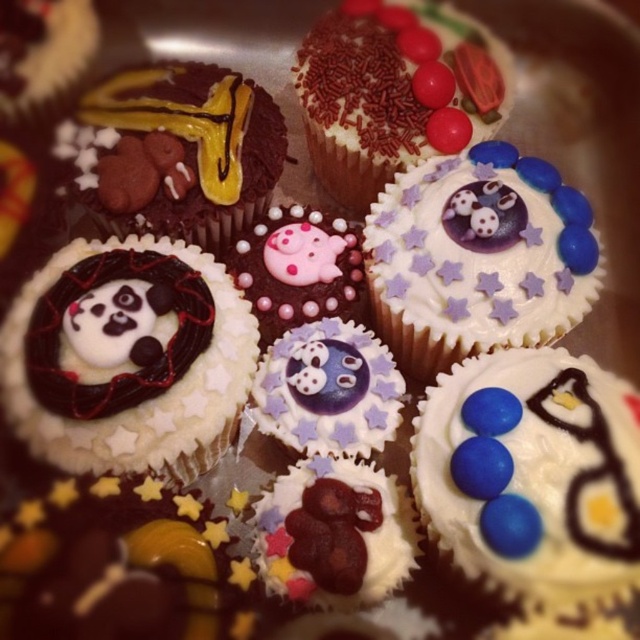
Does chocolate glossy cherries at center have a smaller size compared to chocolate matte pig at center?

Correct, chocolate glossy cherries at center occupies less space than chocolate matte pig at center.

What do you see at coordinates (333, 532) in the screenshot?
I see `chocolate glossy cherries at center` at bounding box center [333, 532].

Which is in front, point (284, 499) or point (278, 301)?

Point (284, 499) is in front.

The height and width of the screenshot is (640, 640). In order to click on chocolate glossy cherries at center in this screenshot , I will do (x=333, y=532).

Does point (68, 416) come closer to viewer compared to point (262, 381)?

Yes, point (68, 416) is in front of point (262, 381).

Is white fondant cupcake with panda decoration at center positioned at the back of purple glossy cupcake at center?

That is False.

Between point (56, 344) and point (282, 349), which one is positioned behind?

The point (282, 349) is behind.

Locate an element on the screen. This screenshot has width=640, height=640. white fondant cupcake with panda decoration at center is located at coordinates (128, 358).

Which is behind, point (176, 193) or point (289, 275)?

Point (289, 275)

Between chocolatesmoothcupcake at center and chocolate matte pig at center, which one is positioned higher?

chocolatesmoothcupcake at center

Is point (280, 170) positioned behind point (333, 269)?

That is True.

Identify the location of chocolatesmoothcupcake at center. (176, 150).